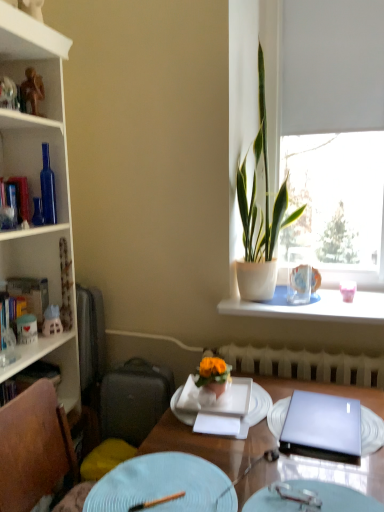
This screenshot has height=512, width=384. I want to click on free space in front of white paper at center, so coord(225,460).